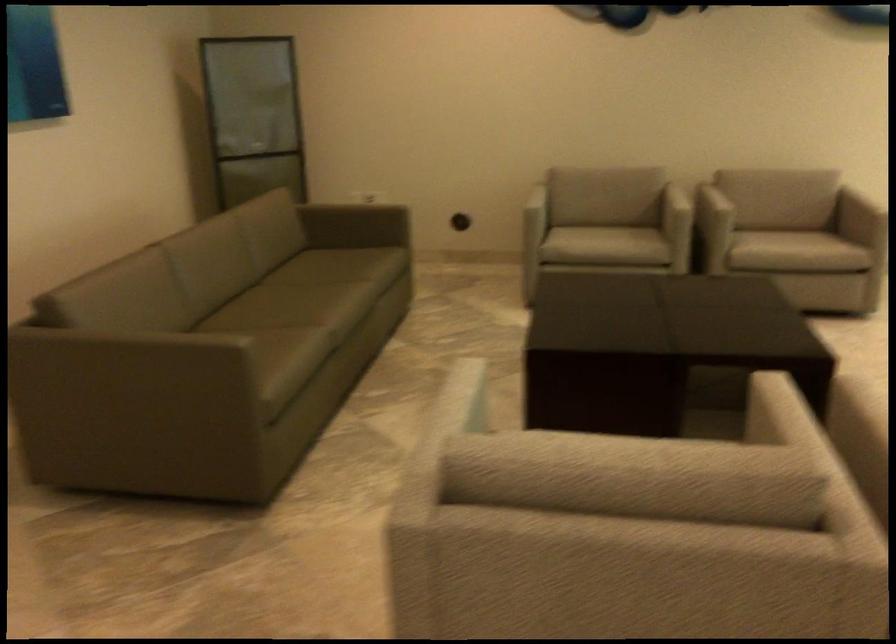
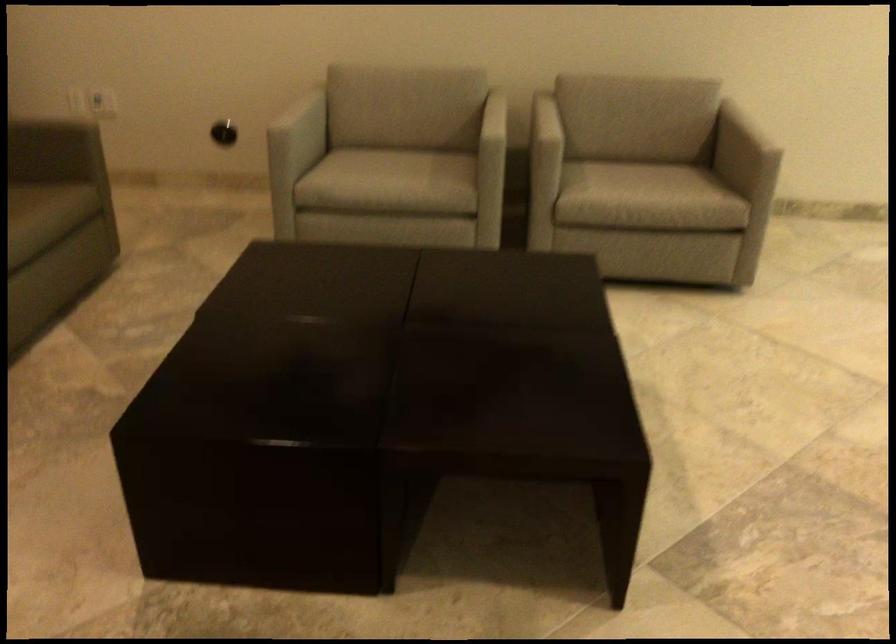
Which direction would the cameraman need to move to produce the second image?

The cameraman moved toward right, forward.